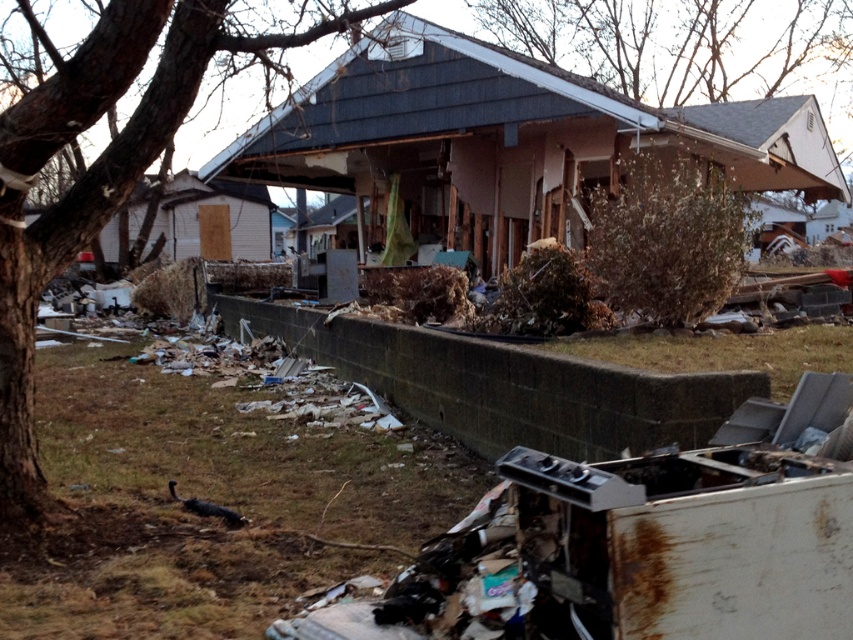
You are a rescue worker standing at the edge of the property where the collapsed house is located. You need to reach the debris pile in the foreground to search for survivors. There is a brown rough bark tree at left blocking your path. Can you walk around it to reach the debris pile?

The brown rough bark tree at left is 17.15 feet away from you. Since it is a tree, you can walk around it to reach the debris pile in the foreground.

Based on the photo, you are a rescue worker assessing the scene of a disaster. You notice the brown rough bark tree at left and the bare branches at upper center. Which object is closer to you from your vantage point?

The brown rough bark tree at left is closer to you because it is in front of the bare branches at upper center.

Based on the scene description, what object is located at the coordinates point (96, 172)?

The point (96, 172) indicates a brown rough bark tree at left.